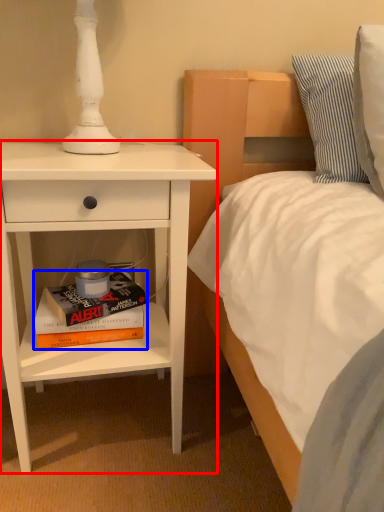
Question: Among these objects, which one is nearest to the camera, nightstand (highlighted by a red box) or book (highlighted by a blue box)?

Choices:
 (A) nightstand
 (B) book

Answer: (A)